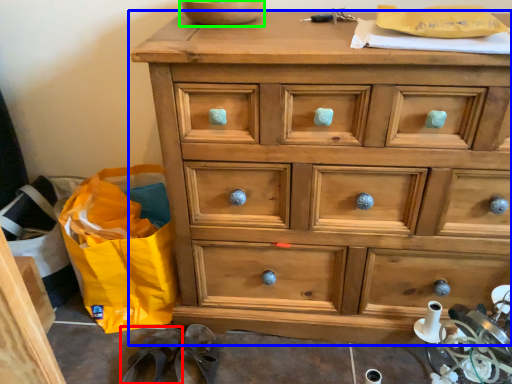
Question: Based on their relative distances, which object is nearer to slipper (highlighted by a red box)? Choose from chest of drawers (highlighted by a blue box) and bowl (highlighted by a green box).

Choices:
 (A) chest of drawers
 (B) bowl

Answer: (A)